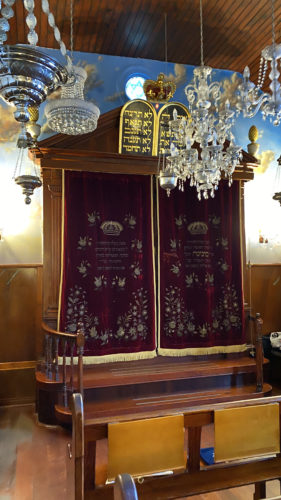
Find the location of `seat`. seat is located at coordinates (210, 434).